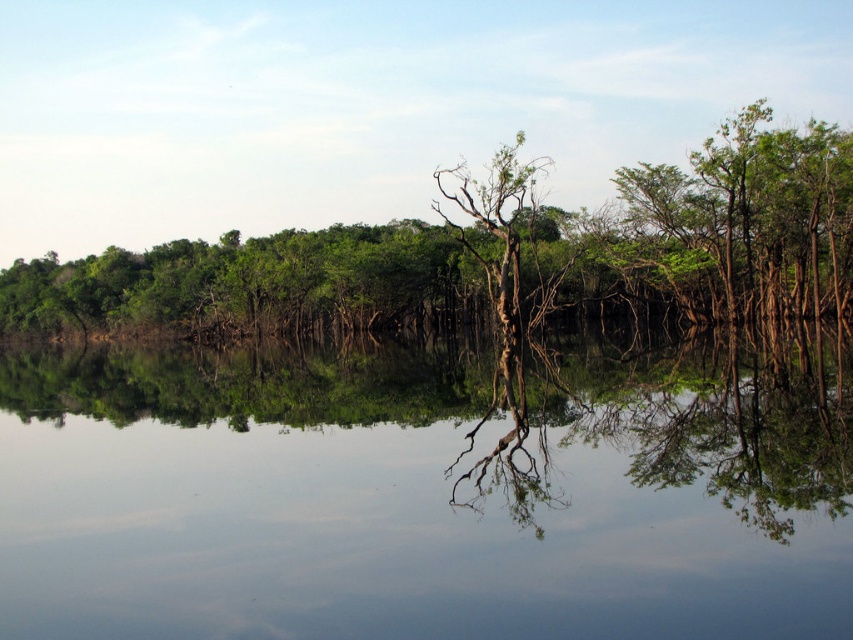
Question: Does transparent water at center have a lesser width compared to green matte tree at center?

Choices:
 (A) yes
 (B) no

Answer: (A)

Question: Which of the following is the closest to the observer?

Choices:
 (A) transparent water at center
 (B) green matte tree at center

Answer: (A)

Question: Which point appears farthest from the camera in this image?

Choices:
 (A) (271, 314)
 (B) (300, 544)

Answer: (A)

Question: Which object appears closest to the camera in this image?

Choices:
 (A) transparent water at center
 (B) green matte tree at center

Answer: (A)

Question: Can you confirm if transparent water at center is positioned below green matte tree at center?

Choices:
 (A) no
 (B) yes

Answer: (B)

Question: Observing the image, what is the correct spatial positioning of transparent water at center in reference to green matte tree at center?

Choices:
 (A) below
 (B) above

Answer: (A)